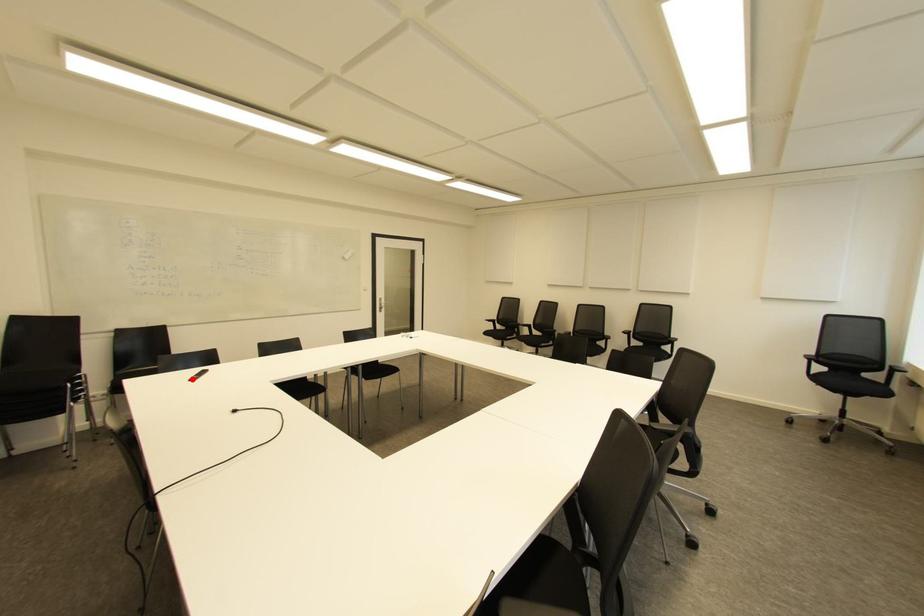
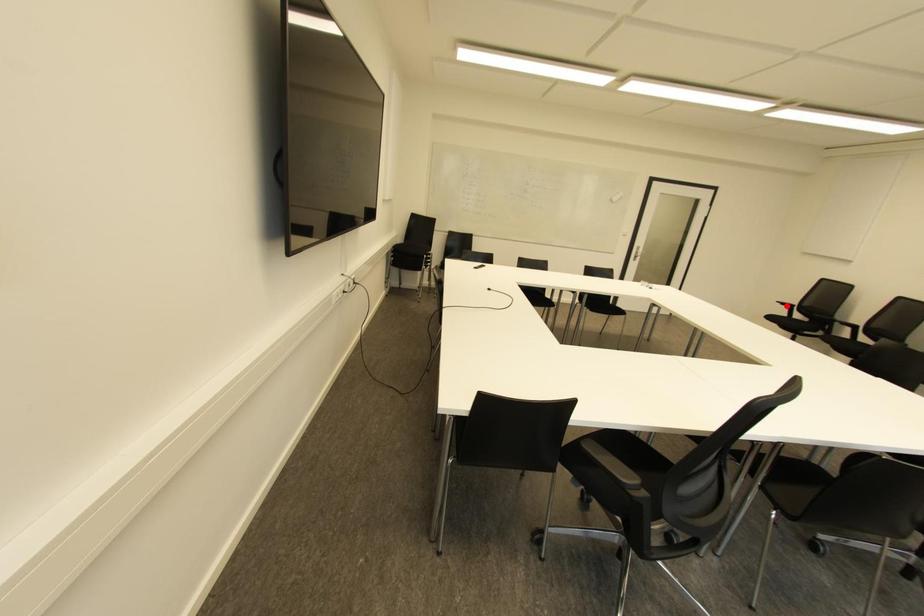
I am providing you with two images of the same scene from different viewpoints. A red point is marked on the first image and another point is marked on the second image. Is the red point in image1 aligned with the point shown in image2?

No